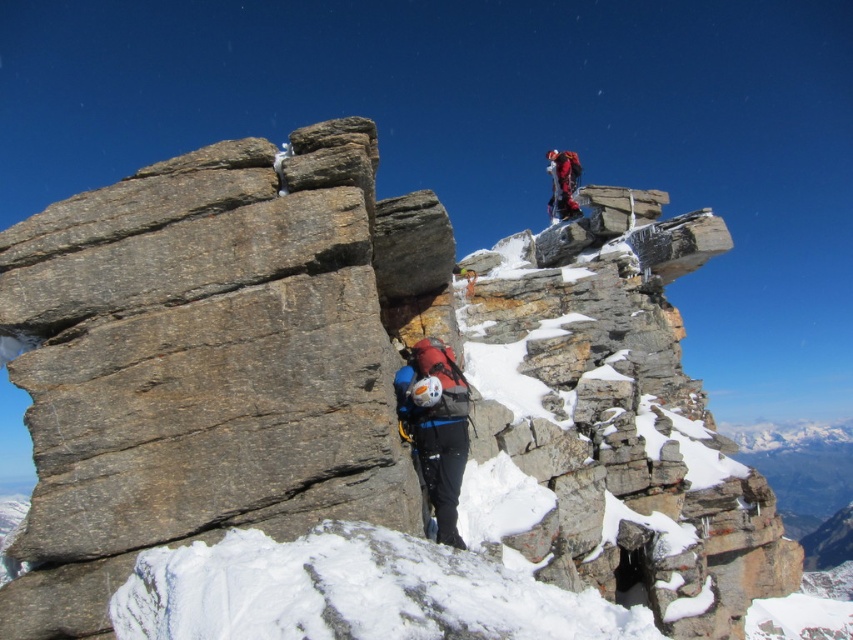
Question: Among these objects, which one is nearest to the camera?

Choices:
 (A) matte blue helmet at center
 (B) red fabric jacket at upper center

Answer: (A)

Question: Which point is farther to the camera?

Choices:
 (A) red fabric jacket at upper center
 (B) matte blue helmet at center

Answer: (A)

Question: Does matte blue helmet at center have a lesser width compared to red fabric jacket at upper center?

Choices:
 (A) no
 (B) yes

Answer: (B)

Question: Is matte blue helmet at center to the left of red fabric jacket at upper center from the viewer's perspective?

Choices:
 (A) no
 (B) yes

Answer: (B)

Question: Is matte blue helmet at center bigger than red fabric jacket at upper center?

Choices:
 (A) yes
 (B) no

Answer: (B)